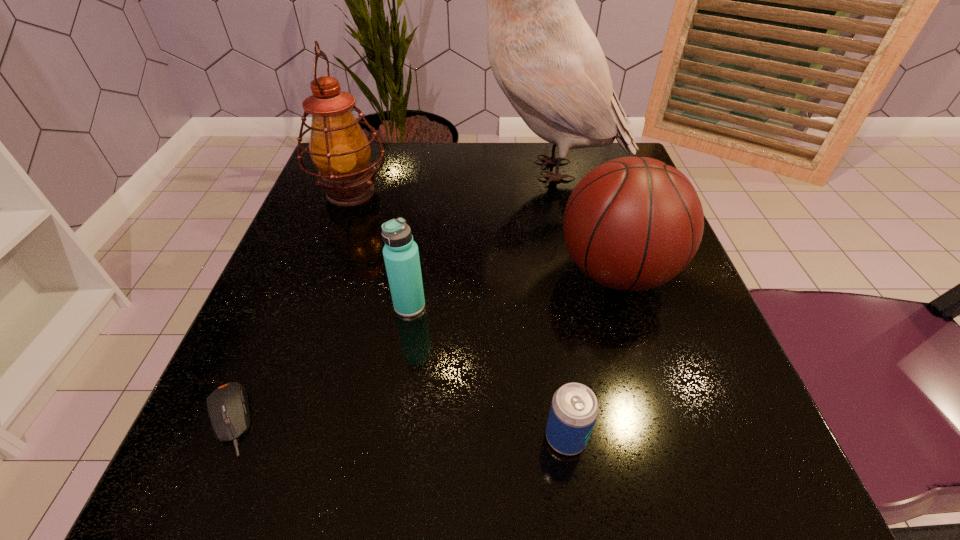
Identify the location of free space between the tallest object and the second shortest object. (557, 303).

Where is `free space between the fourth tallest object and the fifth tallest object`? free space between the fourth tallest object and the fifth tallest object is located at coordinates (488, 372).

The height and width of the screenshot is (540, 960). In order to click on free spot between the second tallest object and the parakeet in this screenshot , I will do `click(449, 181)`.

Identify which object is the third closest to the fourth tallest object. Please provide its 2D coordinates. Your answer should be formatted as a tuple, i.e. [(x, y)], where the tuple contains the x and y coordinates of a point satisfying the conditions above.

[(633, 223)]

Select which object is the third closest to the basketball. Please provide its 2D coordinates. Your answer should be formatted as a tuple, i.e. [(x, y)], where the tuple contains the x and y coordinates of a point satisfying the conditions above.

[(401, 255)]

Where is `free spot that satisfies the following two spatial constraints: 1. on the face of the tallest object; 2. on the front side of the oil lamp`? This screenshot has width=960, height=540. free spot that satisfies the following two spatial constraints: 1. on the face of the tallest object; 2. on the front side of the oil lamp is located at coordinates (552, 192).

The height and width of the screenshot is (540, 960). Find the location of `free space that satisfies the following two spatial constraints: 1. on the face of the third tallest object; 2. on the right side of the parakeet`. free space that satisfies the following two spatial constraints: 1. on the face of the third tallest object; 2. on the right side of the parakeet is located at coordinates (568, 272).

Where is `vacant point that satisfies the following two spatial constraints: 1. on the front side of the beer can; 2. on the left side of the second tallest object`? vacant point that satisfies the following two spatial constraints: 1. on the front side of the beer can; 2. on the left side of the second tallest object is located at coordinates (262, 437).